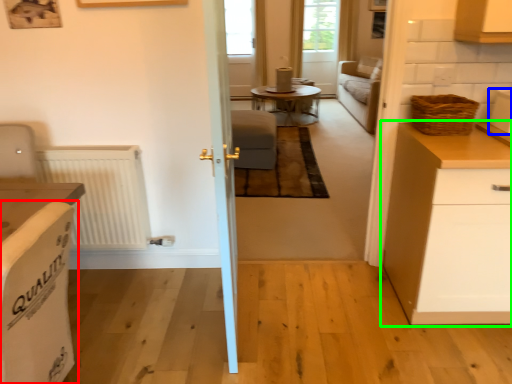
Question: Which is nearer to the armchair (highlighted by a red box)? appliance (highlighted by a blue box) or cabinetry (highlighted by a green box).

Choices:
 (A) appliance
 (B) cabinetry

Answer: (B)